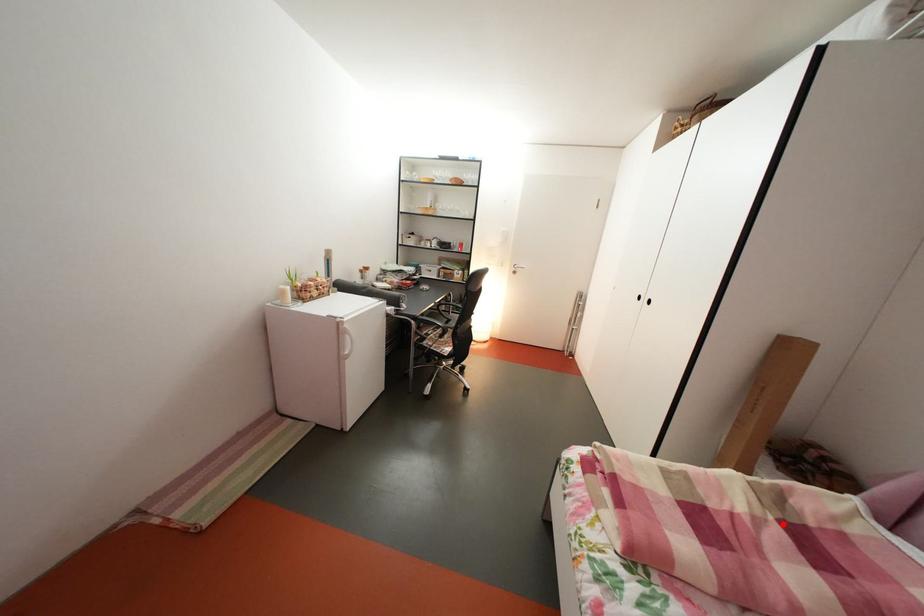
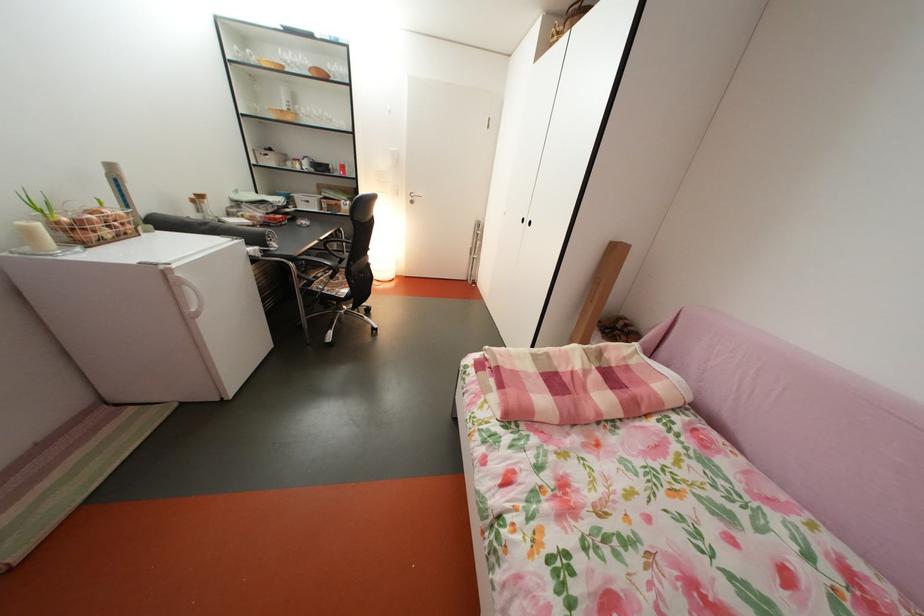
Locate, in the second image, the point that corresponds to the highlighted location in the first image.

(604, 374)